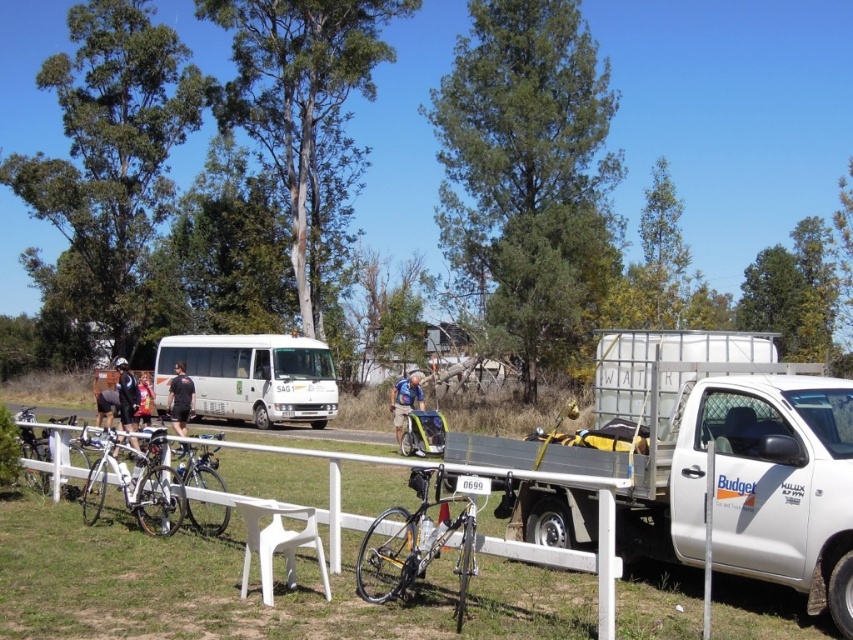
Question: Considering the relative positions of shiny silver bicycle at center and shiny silver bicycle at left in the image provided, where is shiny silver bicycle at center located with respect to shiny silver bicycle at left?

Choices:
 (A) right
 (B) left

Answer: (A)

Question: Which point is farther to the camera?

Choices:
 (A) white matte van at center
 (B) shiny silver bicycle at left

Answer: (A)

Question: Is black fabric shorts at center to the left of blue fabric shirt at center from the viewer's perspective?

Choices:
 (A) no
 (B) yes

Answer: (B)

Question: Can you confirm if white plastic fence at lower center is thinner than shiny silver bicycle at lower left?

Choices:
 (A) yes
 (B) no

Answer: (B)

Question: Which object is farther from the camera taking this photo?

Choices:
 (A) dark gray helmet at left
 (B) yellow fabric shirt at center
 (C) white metallic trailer truck at right
 (D) blue fabric shirt at center

Answer: (D)

Question: Considering the real-world distances, which object is closest to the white matte van at center?

Choices:
 (A) yellow fabric shirt at center
 (B) blue fabric shirt at center
 (C) shiny silver bicycle at left
 (D) silver metallic bicycle at left

Answer: (A)